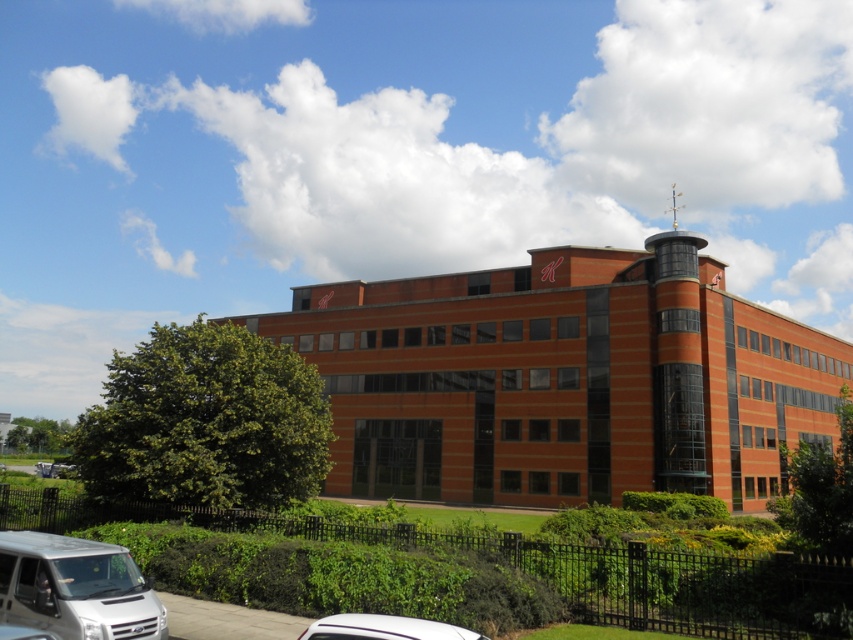
Measure the distance between green leafy hedge at lower left and white glossy car at lower center.

green leafy hedge at lower left is 15.95 meters from white glossy car at lower center.

Between green leafy hedge at lower left and white glossy car at lower center, which one has less height?

white glossy car at lower center is shorter.

Describe the element at coordinates (206, 420) in the screenshot. This screenshot has height=640, width=853. I see `green leafy hedge at lower left` at that location.

At what (x,y) coordinates should I click in order to perform the action: click on green leafy hedge at lower left. Please return your answer as a coordinate pair (x, y). Looking at the image, I should click on (206, 420).

Does green leafy hedge at lower left have a larger size compared to white matte van at lower left?

Yes, green leafy hedge at lower left is bigger than white matte van at lower left.

Is point (268, 412) positioned before point (45, 577)?

No.

The image size is (853, 640). I want to click on green leafy hedge at lower left, so click(x=206, y=420).

Is white matte van at lower left taller than white glossy car at lower center?

Yes.

Locate an element on the screen. white matte van at lower left is located at coordinates (74, 588).

Between point (111, 604) and point (445, 634), which one is positioned behind?

The point (111, 604) is more distant.

Where is `white matte van at lower left`? This screenshot has width=853, height=640. white matte van at lower left is located at coordinates (74, 588).